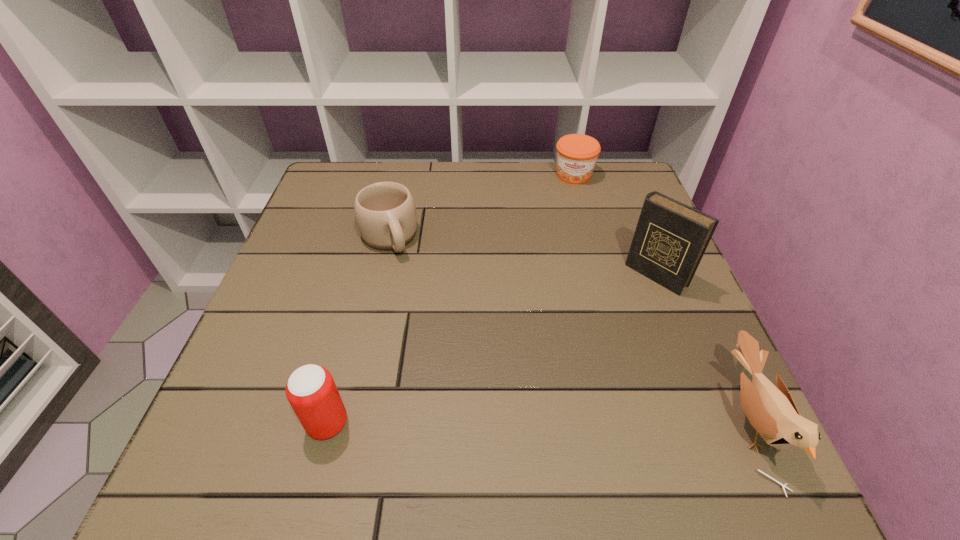
The width and height of the screenshot is (960, 540). What are the coordinates of `beer can at the near edge` in the screenshot? It's located at (311, 391).

The width and height of the screenshot is (960, 540). Find the location of `bird present at the near edge`. bird present at the near edge is located at coordinates (772, 412).

This screenshot has width=960, height=540. I want to click on beer can positioned at the left edge, so click(x=311, y=391).

I want to click on mug that is positioned at the left edge, so click(385, 212).

You are a GUI agent. You are given a task and a screenshot of the screen. Output one action in this format:
    pyautogui.click(x=<x>, y=<y>)
    Task: Click on the bird that is at the right edge
    This screenshot has height=540, width=960.
    Given the screenshot: What is the action you would take?
    pyautogui.click(x=772, y=412)

You are a GUI agent. You are given a task and a screenshot of the screen. Output one action in this format:
    pyautogui.click(x=<x>, y=<y>)
    Task: Click on the diary that is positioned at the right edge
    The width and height of the screenshot is (960, 540).
    Given the screenshot: What is the action you would take?
    pyautogui.click(x=670, y=239)

I want to click on jam that is at the right edge, so click(x=577, y=154).

This screenshot has height=540, width=960. I want to click on object positioned at the near left corner, so click(311, 391).

The image size is (960, 540). What are the coordinates of `object located at the far right corner` in the screenshot? It's located at (577, 154).

This screenshot has height=540, width=960. What are the coordinates of `object present at the near right corner` in the screenshot? It's located at (772, 412).